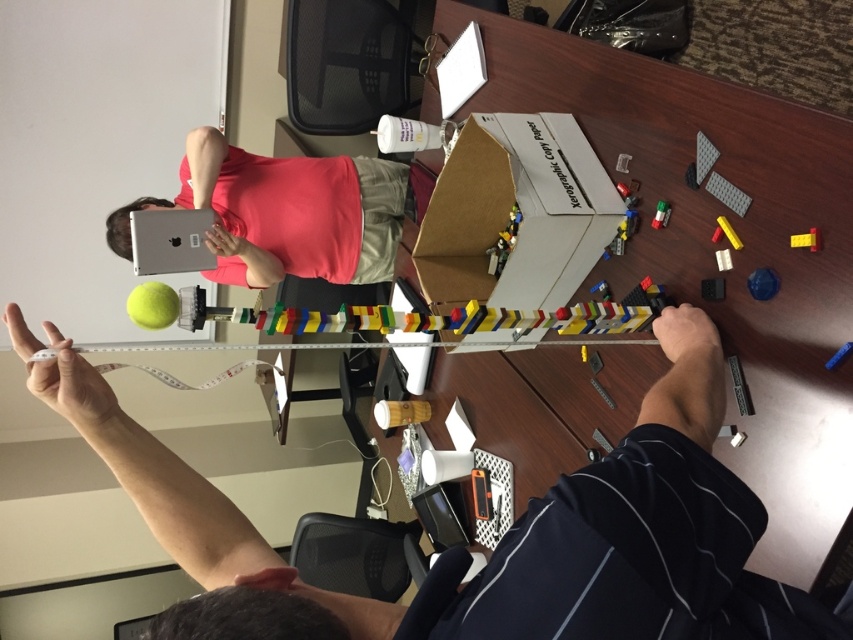
You are standing in front of the wooden table at center and want to place a 30 inch long object on it. Can you fit the object entirely on the table without overhanging?

The wooden table at center is 30.55 inches away from the camera, so the object of 30 inch length can be placed entirely on the table without overhanging.